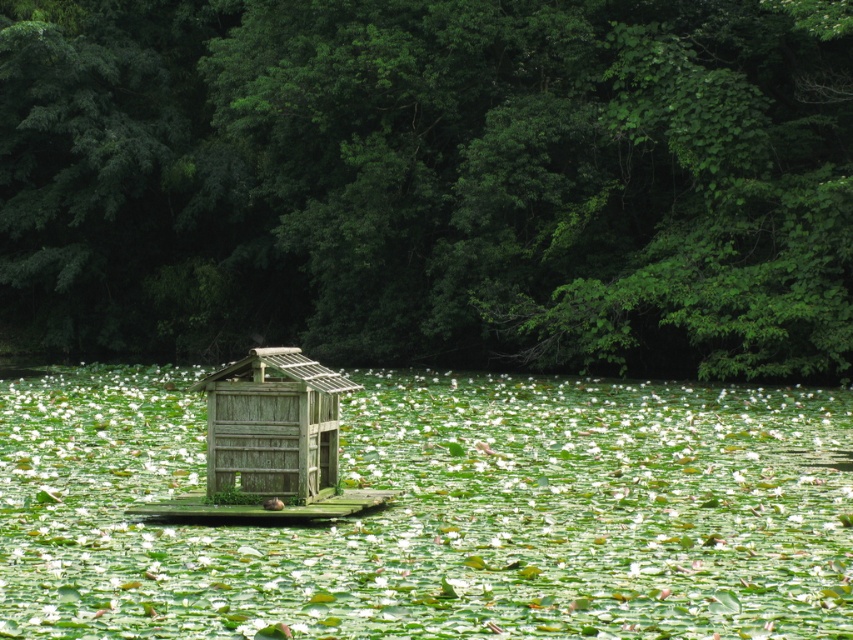
From the picture: You are planning to build a birdhouse in the serene natural scene. You need to choose between placing it on the green leafy trees at center or the weathered wood hut at center. Which location would allow the birdhouse to be more visible to visitors approaching from the pond side?

The birdhouse placed on the green leafy trees at center would be more visible to visitors approaching from the pond side since the green leafy trees at center are larger in size compared to the weathered wood hut at center, making them a better vantage point.

From the picture: You are planning to build a small boat that is 2 meters wide. You want to navigate through the green leafy water at center while avoiding the green leafy trees at center. Can your boat safely pass through the area between them?

The green leafy trees at center might be wider than the green leafy water at center, so there is uncertainty about whether the boat can safely pass. It is advisable to measure the width of the water area before proceeding.